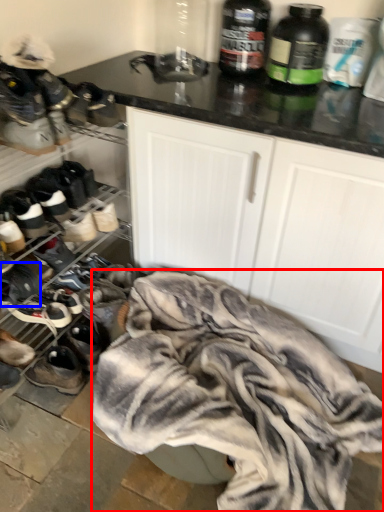
Question: Which point is closer to the camera, clothing (highlighted by a red box) or footwear (highlighted by a blue box)?

Choices:
 (A) clothing
 (B) footwear

Answer: (A)